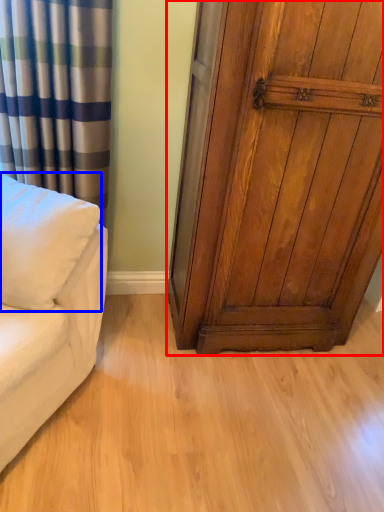
Question: Which point is closer to the camera, door (highlighted by a red box) or pillow (highlighted by a blue box)?

Choices:
 (A) door
 (B) pillow

Answer: (B)